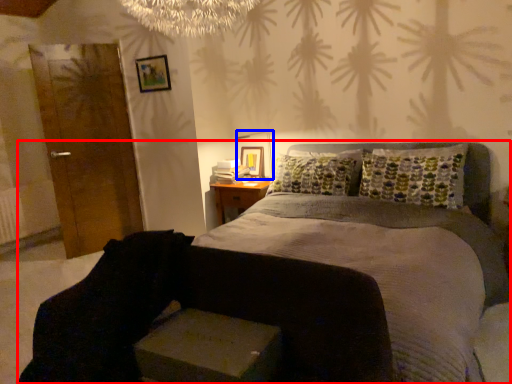
Question: Which of the following is the closest to the observer, bed (highlighted by a red box) or table lamp (highlighted by a blue box)?

Choices:
 (A) bed
 (B) table lamp

Answer: (A)